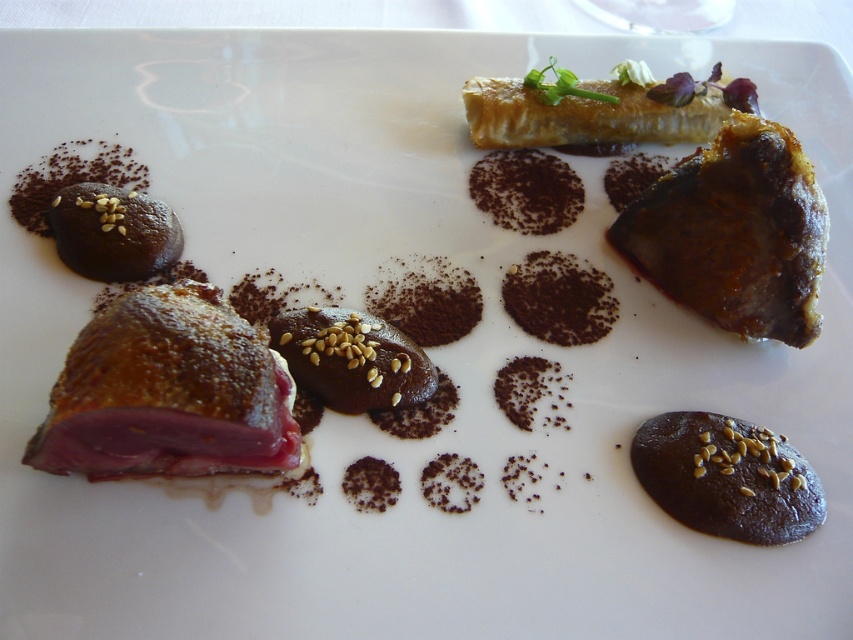
You are a food critic who needs to take a bite of both the brown crispy duck at lower left and the golden brown flaky pastry at upper right. If your hand can reach 25 inches, can you reach both items without moving the plate?

The distance between the brown crispy duck at lower left and the golden brown flaky pastry at upper right is 26.28 inches. Since your hand can only reach 25 inches, you cannot reach both items without moving the plate.

You are a food critic evaluating this dish. The plate has limited space. Which component, the savory brown crumbly pastry at upper right or the brown chocolate with seeds at center, would you recommend removing to make room for an additional sauce drizzle? Explain your choice based on their sizes.

The savory brown crumbly pastry at upper right is bigger than the brown chocolate with seeds at center. Therefore, removing the savory brown crumbly pastry at upper right would free up more space for the sauce drizzle.

You are a food critic analyzing the arrangement of the dish. Based on the positioning of the savory brown crumbly pastry at upper right and the brown chocolate with seeds at center, which component is positioned to the right side of the other?

The savory brown crumbly pastry at upper right is to the right of the brown chocolate with seeds at center.